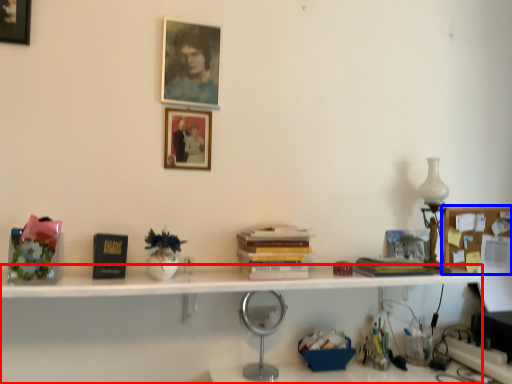
Question: Which of the following is the closest to the observer, bookshelf (highlighted by a red box) or shelf (highlighted by a blue box)?

Choices:
 (A) bookshelf
 (B) shelf

Answer: (A)